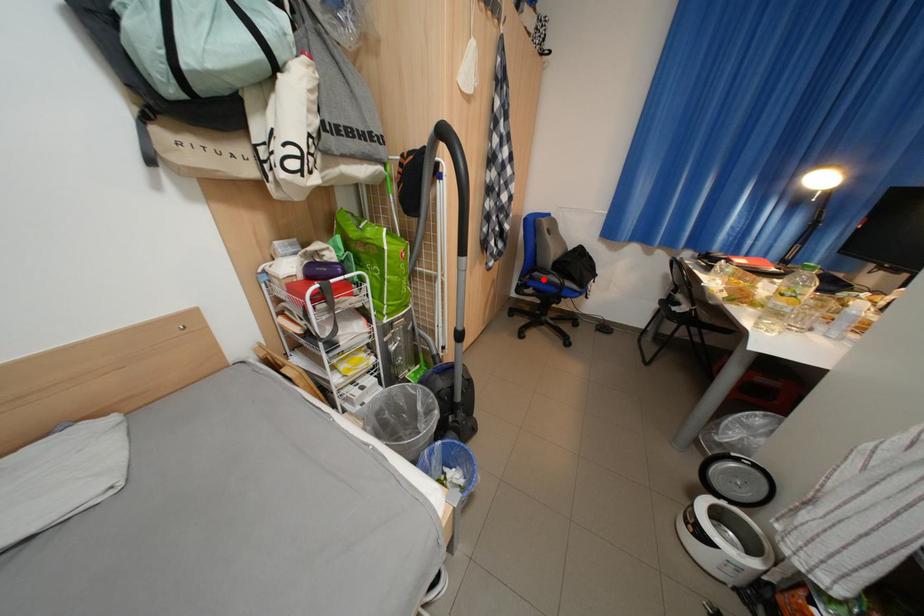
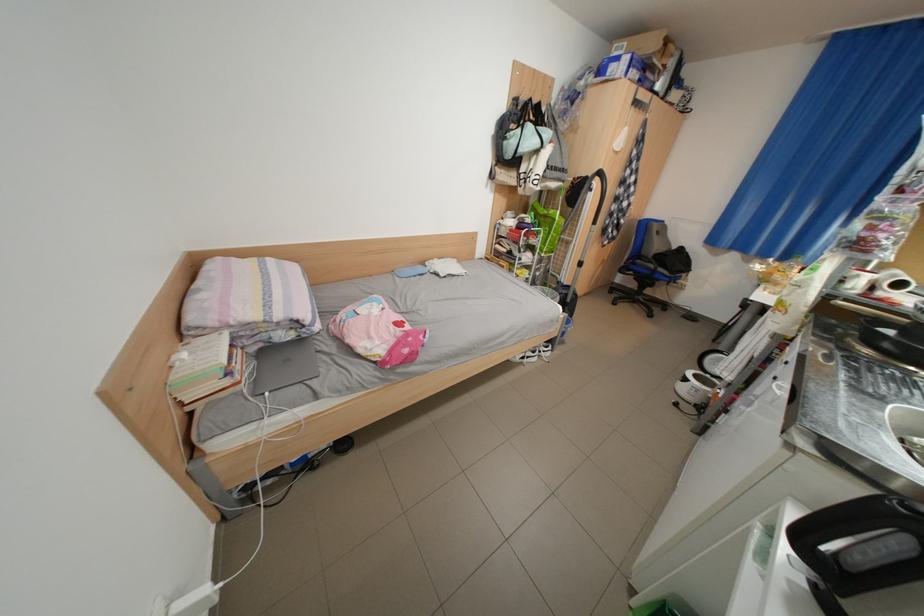
The point at the highlighted location is marked in the first image. Where is the corresponding point in the second image?

(646, 265)